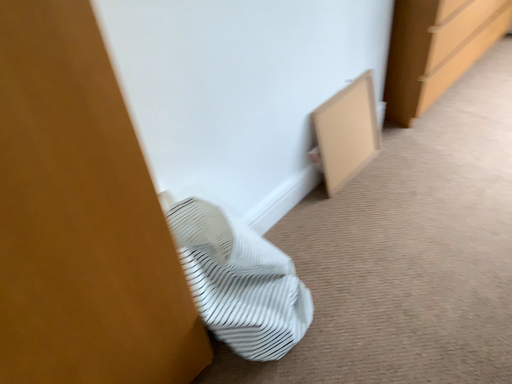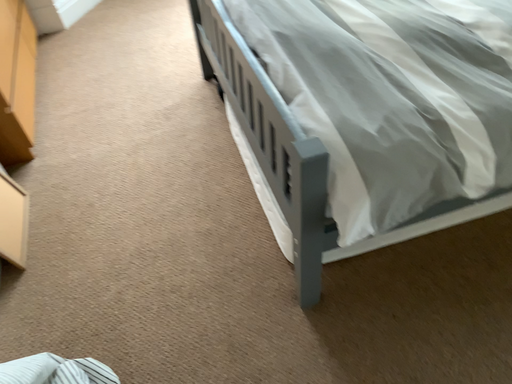
Question: Which way did the camera rotate in the video?

Choices:
 (A) rotated downward
 (B) rotated upward

Answer: (B)